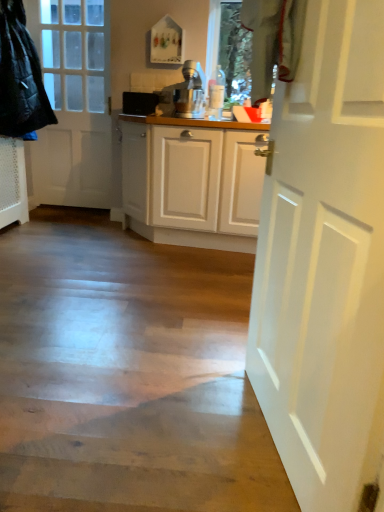
Question: From the image's perspective, is white matte door at right, the second door viewed from the left, beneath white matte door at left, placed as the second door when sorted from right to left?

Choices:
 (A) no
 (B) yes

Answer: (B)

Question: Could you tell me if white matte door at right, the first door when ordered from bottom to top, is turned towards white matte door at left, the first door in the top-to-bottom sequence?

Choices:
 (A) yes
 (B) no

Answer: (B)

Question: Is white matte door at right, which appears as the 1th door when viewed from the right, at the left side of white matte door at left, placed as the second door when sorted from right to left?

Choices:
 (A) yes
 (B) no

Answer: (B)

Question: From the image's perspective, is white matte door at right, which appears as the 1th door when viewed from the right, on white matte door at left, placed as the second door when sorted from right to left?

Choices:
 (A) no
 (B) yes

Answer: (A)

Question: Is white matte door at right, the first door when ordered from bottom to top, outside white matte door at left, the first door when ordered from back to front?

Choices:
 (A) yes
 (B) no

Answer: (A)

Question: Which is correct: quilted black jacket at left is inside white matte door at right, the second door viewed from the left, or outside of it?

Choices:
 (A) outside
 (B) inside

Answer: (A)

Question: In the image, is quilted black jacket at left on the left side or the right side of white matte door at right, the second door viewed from the left?

Choices:
 (A) right
 (B) left

Answer: (B)

Question: Considering the positions of quilted black jacket at left and white matte door at right, which appears as the 1th door when viewed from the right, in the image, is quilted black jacket at left bigger or smaller than white matte door at right, which appears as the 1th door when viewed from the right,?

Choices:
 (A) small
 (B) big

Answer: (B)

Question: In terms of width, does quilted black jacket at left look wider or thinner when compared to white matte door at right, which appears as the 1th door when viewed from the right?

Choices:
 (A) wide
 (B) thin

Answer: (A)

Question: In the image, is black plastic speaker at center positioned in front of or behind white matte door at left, the first door when ordered from back to front?

Choices:
 (A) front
 (B) behind

Answer: (A)

Question: In terms of size, does black plastic speaker at center appear bigger or smaller than white matte door at left, the second door ordered from the bottom?

Choices:
 (A) big
 (B) small

Answer: (B)

Question: Is point (153, 93) closer or farther from the camera than point (61, 126)?

Choices:
 (A) closer
 (B) farther

Answer: (A)

Question: From a real-world perspective, is black plastic speaker at center above or below white matte door at left, which is counted as the second door, starting from the front?

Choices:
 (A) below
 (B) above

Answer: (B)

Question: Is white matte door at left, which is counted as the second door, starting from the front, taller or shorter than black plastic speaker at center?

Choices:
 (A) tall
 (B) short

Answer: (A)

Question: Is white matte door at left, which is counted as the second door, starting from the front, spatially inside black plastic speaker at center, or outside of it?

Choices:
 (A) inside
 (B) outside

Answer: (B)